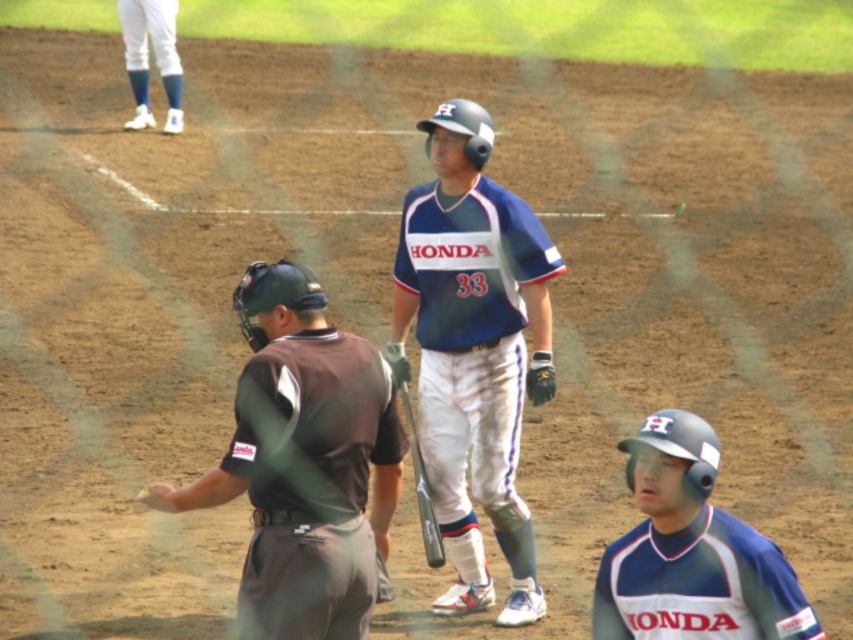
You are a photographer standing at the edge of the infield. You want to take a photo that includes both the umpire and the player on the right. The umpire is at point [305,616] and the player on the right is at point [712,529]. Which of these points is closer to your camera position?

Point [305,616] is closer to the camera than point [712,529] because it is further to the viewer according to the spatial description.

You are a spectator at the baseball game and want to locate the dark green uniform at center. Based on the coordinates provided in the scene description, where should you look relative to the umpire?

The dark green uniform at center is located at point (305, 464), which is to the right and slightly forward of the umpire.

Based on the coordinates provided, where is the dark green uniform at center located in the image?

The dark green uniform at center is located at the 2D coordinates point (305, 464).